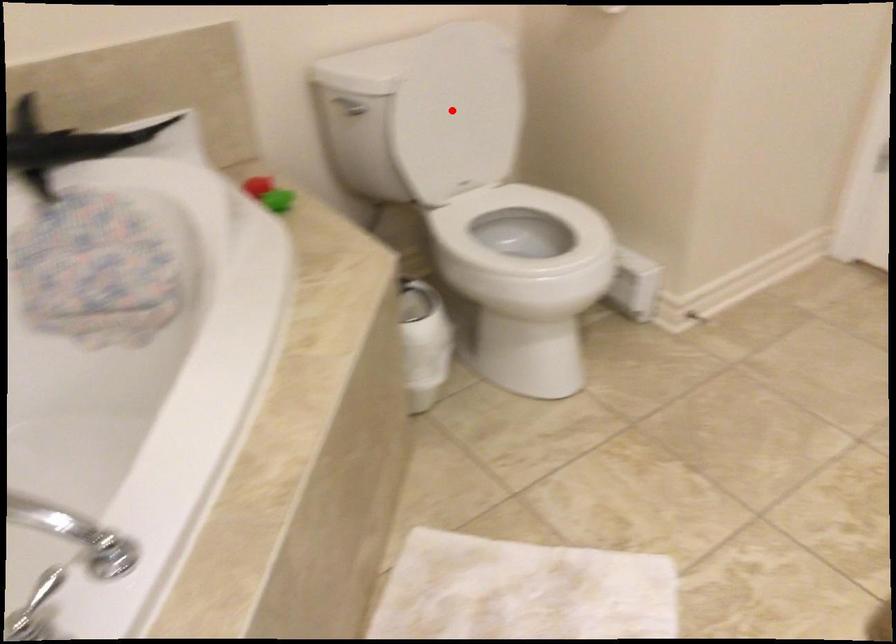
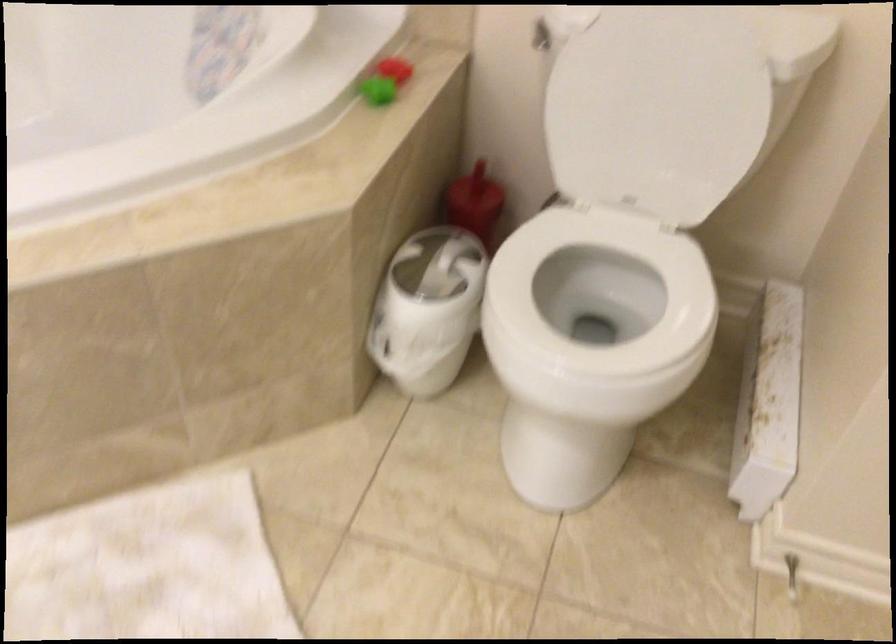
Find the pixel in the second image that matches the highlighted location in the first image.

(657, 109)